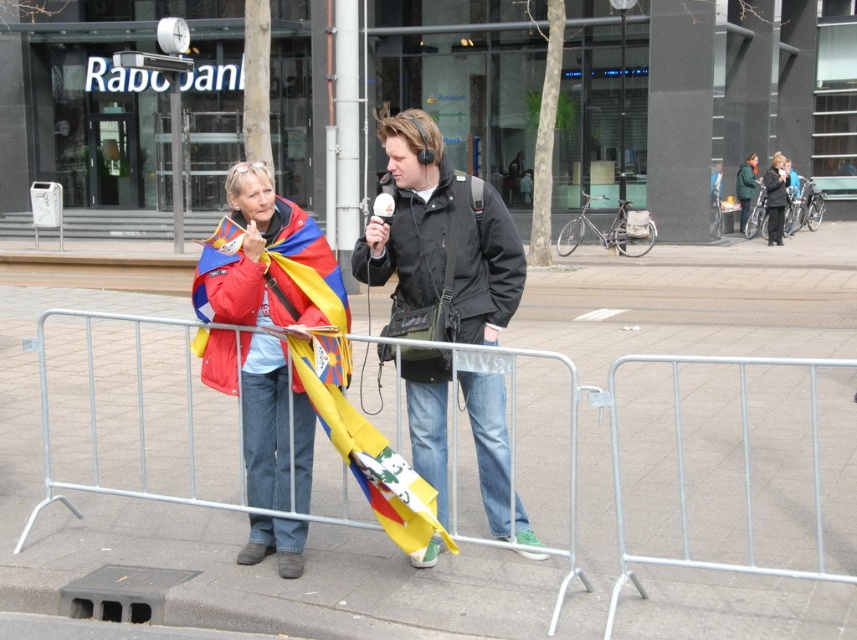
Question: Among these objects, which one is farthest from the camera?

Choices:
 (A) metal at center
 (B) black matte jacket at center

Answer: (A)

Question: In this image, where is metal at center located relative to yellow fabric flag at center?

Choices:
 (A) above
 (B) below

Answer: (B)

Question: Among these points, which one is nearest to the camera?

Choices:
 (A) (652, 588)
 (B) (478, 300)

Answer: (A)

Question: Which object is the farthest from the dark gray coat at center?

Choices:
 (A) yellow fabric flag at center
 (B) metal at center
 (C) matte red jacket at center
 (D) black matte jacket at center

Answer: (C)

Question: Does black matte jacket at center appear under dark gray coat at center?

Choices:
 (A) no
 (B) yes

Answer: (B)

Question: Is metal at center positioned at the back of yellow fabric flag at center?

Choices:
 (A) no
 (B) yes

Answer: (B)